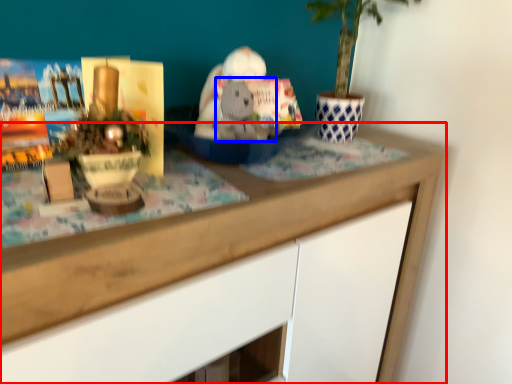
Question: Which of the following is the closest to the observer, desk (highlighted by a red box) or animal (highlighted by a blue box)?

Choices:
 (A) desk
 (B) animal

Answer: (A)